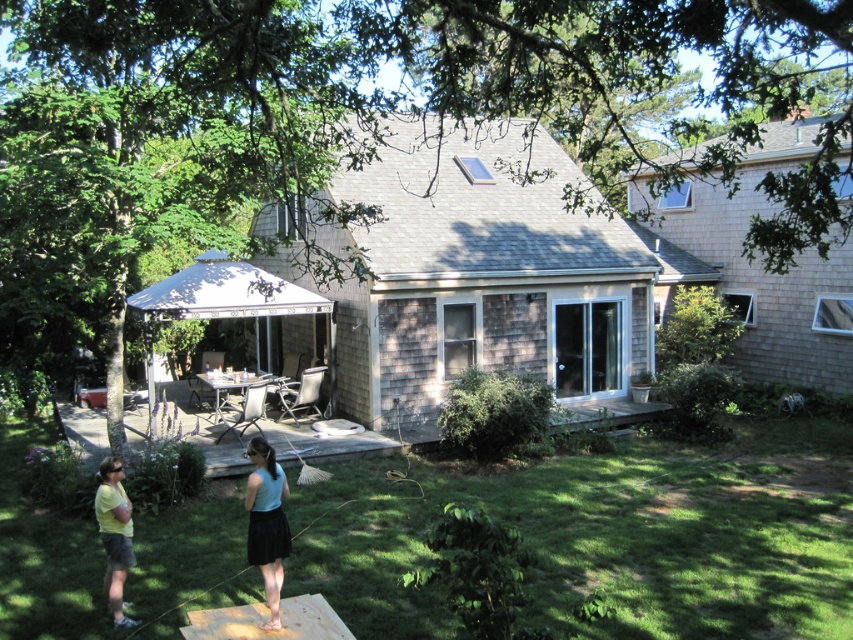
Does wooden deck at center come in front of yellow t-shirt at lower left?

That is False.

Which is behind, point (415, 440) or point (103, 465)?

The point (415, 440) is more distant.

Where is `wooden deck at center`? wooden deck at center is located at coordinates (344, 442).

Does wooden deck at center have a lesser width compared to light blue fabric skirt at lower center?

No, wooden deck at center is not thinner than light blue fabric skirt at lower center.

Is point (198, 444) more distant than point (270, 508)?

Yes, it is.

Is point (103, 419) closer to camera compared to point (271, 598)?

That is False.

At what (x,y) coordinates should I click in order to perform the action: click on wooden deck at center. Please return your answer as a coordinate pair (x, y). The height and width of the screenshot is (640, 853). Looking at the image, I should click on (344, 442).

Which of these two, light blue fabric skirt at lower center or yellow t-shirt at lower left, stands taller?

light blue fabric skirt at lower center is taller.

Can you confirm if light blue fabric skirt at lower center is wider than yellow t-shirt at lower left?

In fact, light blue fabric skirt at lower center might be narrower than yellow t-shirt at lower left.

Find the location of a particular element. light blue fabric skirt at lower center is located at coordinates (265, 524).